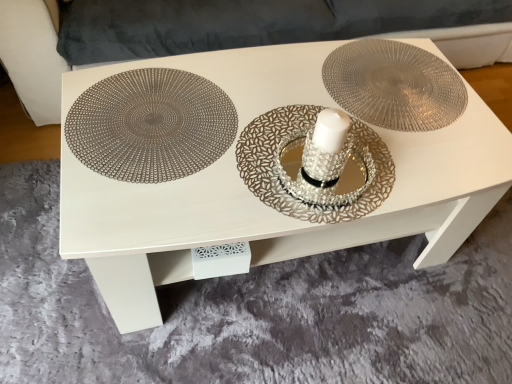
Where is `vacant space underneath metallic textured saucer at center (from a real-world perspective)`? The width and height of the screenshot is (512, 384). vacant space underneath metallic textured saucer at center (from a real-world perspective) is located at coordinates (394, 87).